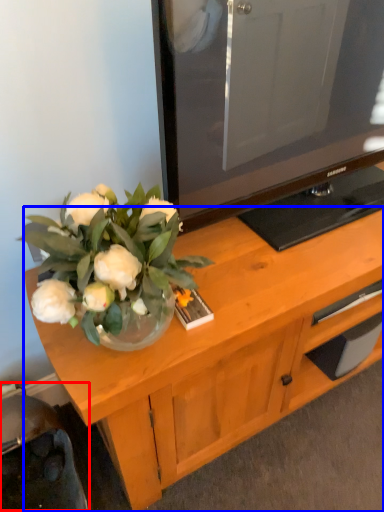
Question: Which of the following is the farthest to the observer, swivel chair (highlighted by a red box) or desk (highlighted by a blue box)?

Choices:
 (A) swivel chair
 (B) desk

Answer: (B)